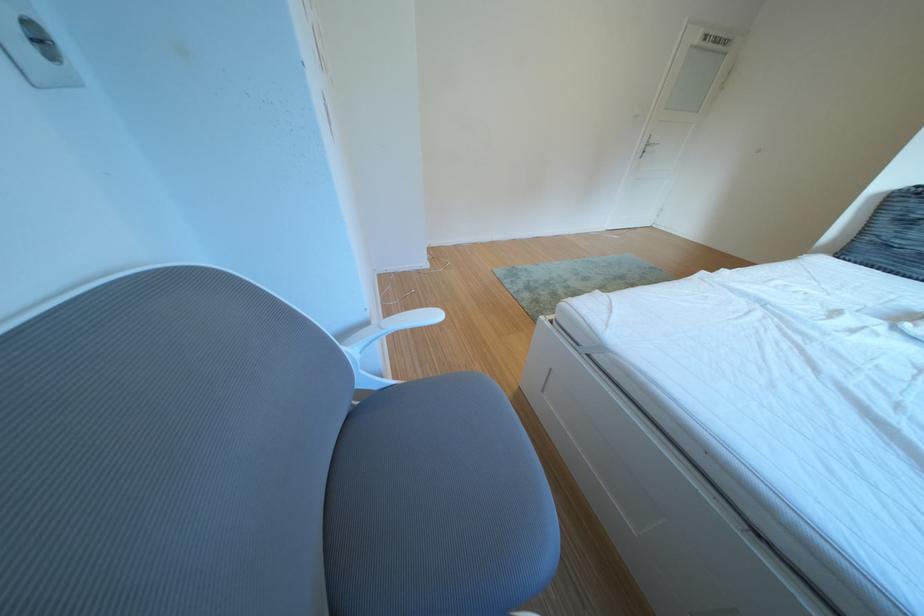
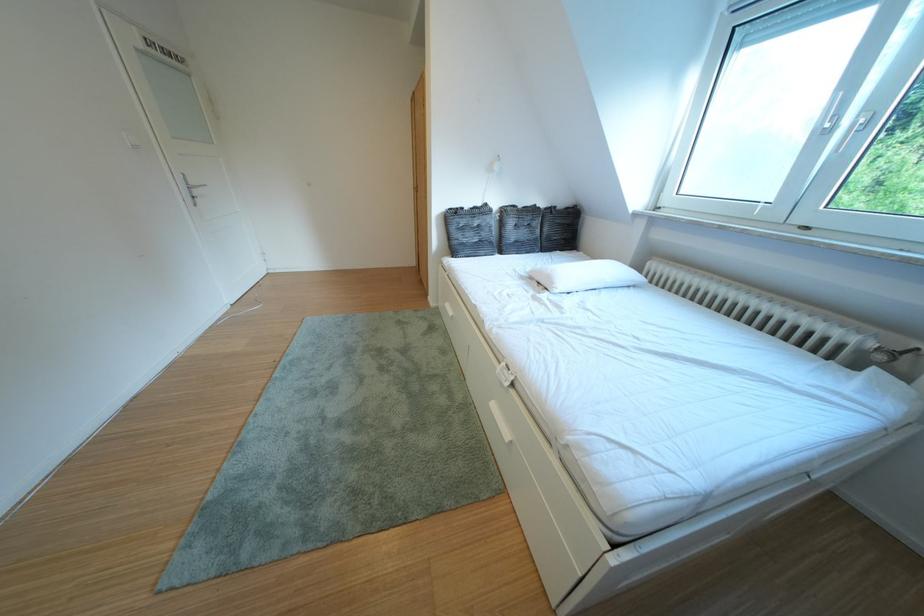
The point at [881,244] is marked in the first image. Where is the corresponding point in the second image?

(468, 246)